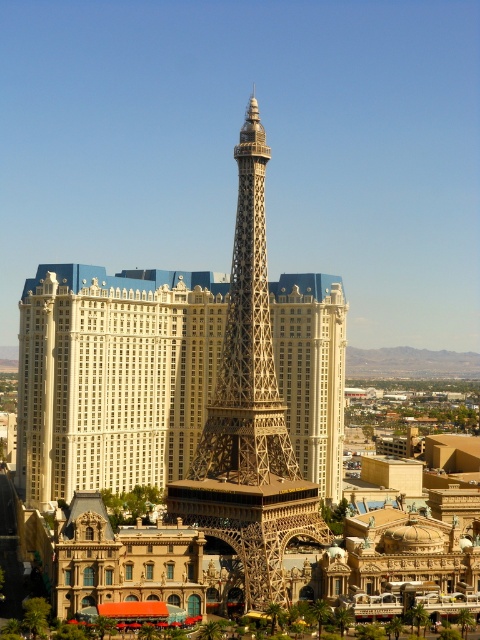
Is gold metallic eiffel tower at center bigger than metallic gold eiffel tower at center?

Yes.

Measure the distance between gold metallic eiffel tower at center and camera.

gold metallic eiffel tower at center is 112.88 meters from camera.

Where is `gold metallic eiffel tower at center`? This screenshot has width=480, height=640. gold metallic eiffel tower at center is located at coordinates (113, 376).